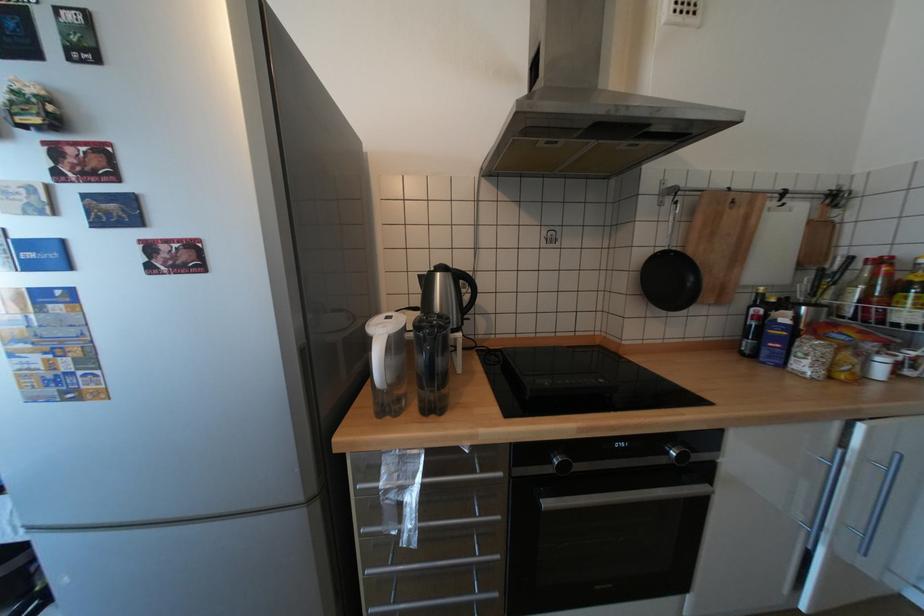
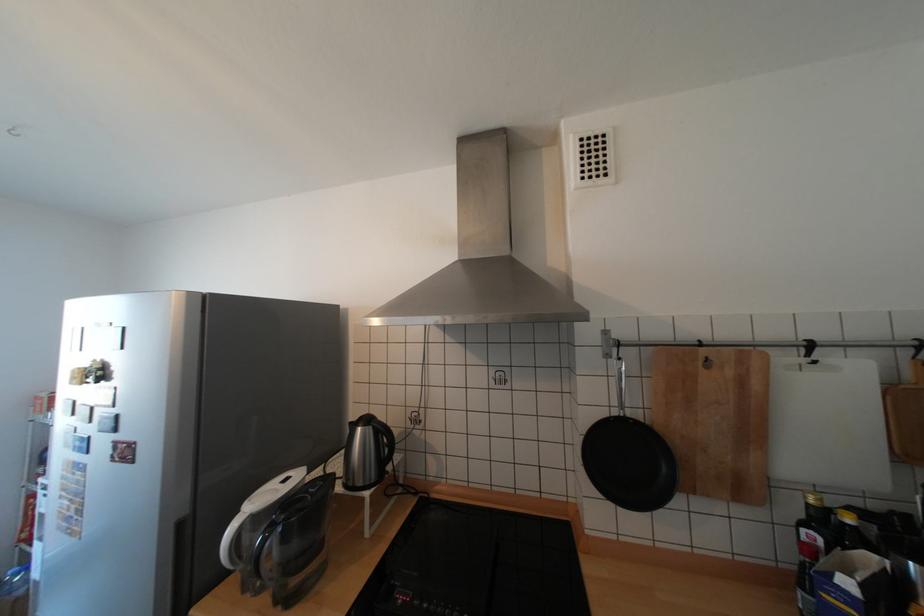
Where in the second image is the point corresponding to [61,108] from the first image?

(108, 373)